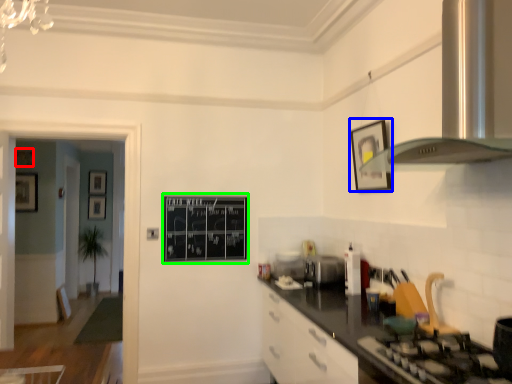
Question: Estimate the real-world distances between objects in this image. Which object is farther from picture frame (highlighted by a red box), picture frame (highlighted by a blue box) or bulletin board (highlighted by a green box)?

Choices:
 (A) picture frame
 (B) bulletin board

Answer: (A)